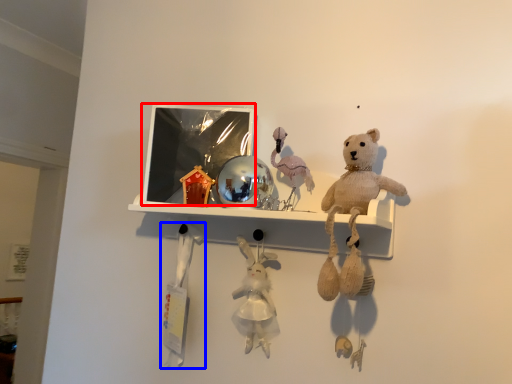
Question: Among these objects, which one is nearest to the camera, picture frame (highlighted by a red box) or toy (highlighted by a blue box)?

Choices:
 (A) picture frame
 (B) toy

Answer: (A)